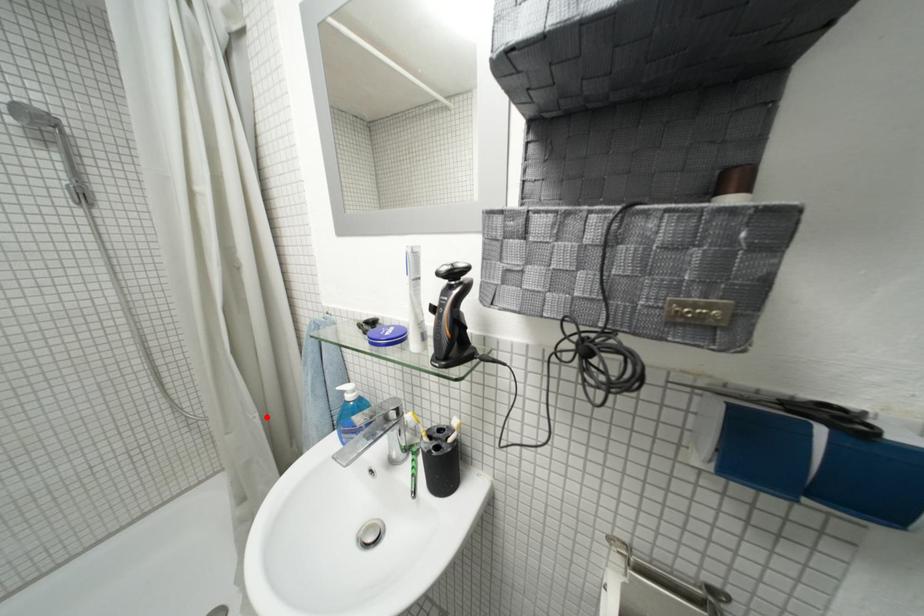
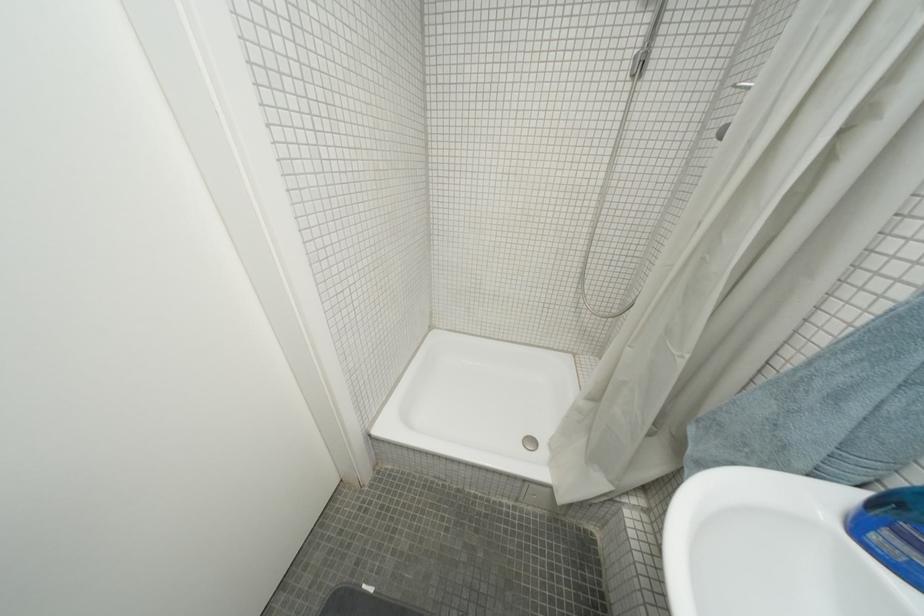
Locate, in the second image, the point that corresponds to the highlighted location in the first image.

(697, 359)